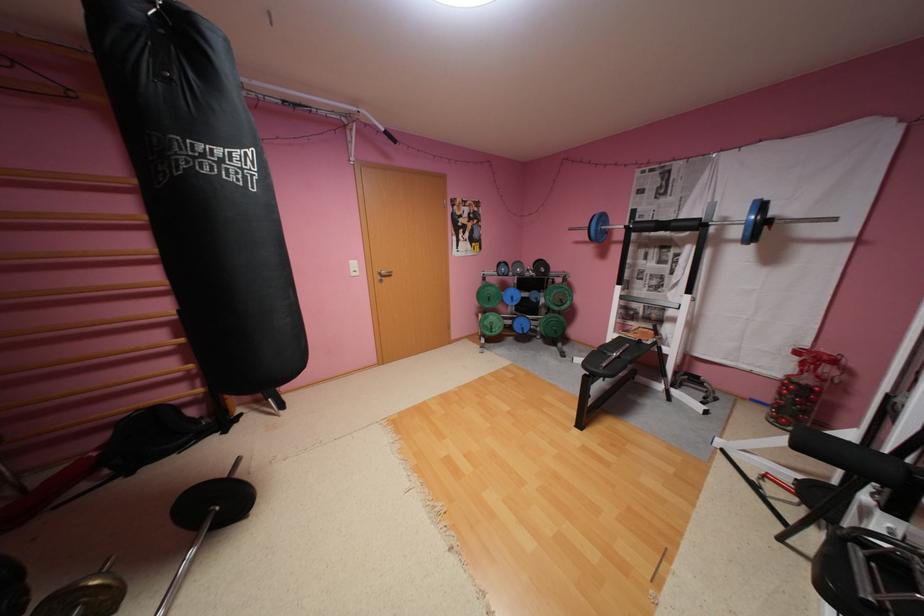
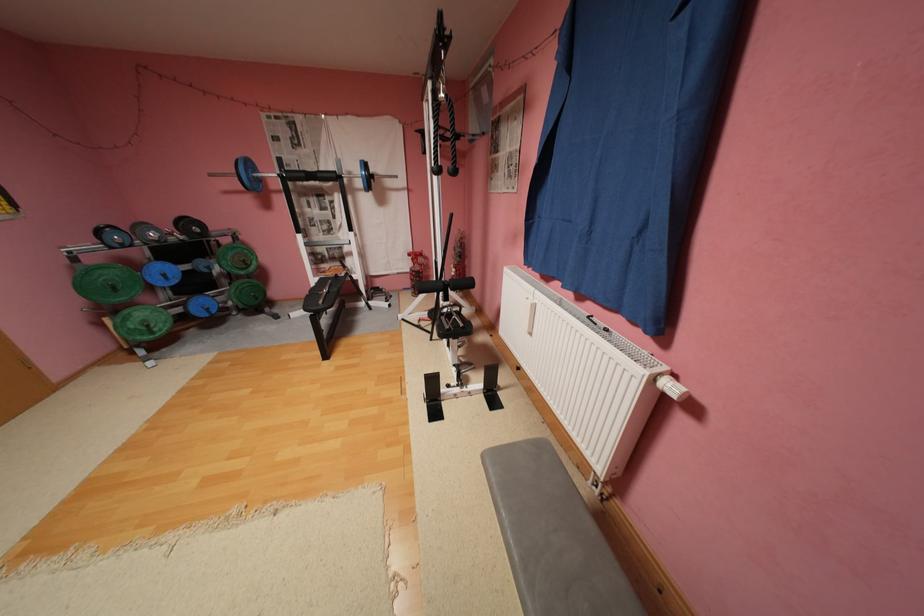
First-person continuous shooting, in which direction is the camera rotating?

The camera's rotation is toward right-down.